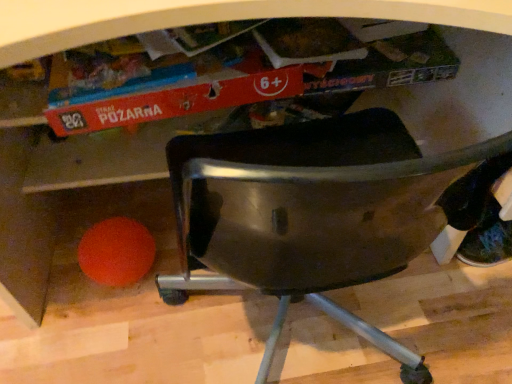
This screenshot has height=384, width=512. Describe the element at coordinates (320, 212) in the screenshot. I see `metallic black chair at center` at that location.

You are a GUI agent. You are given a task and a screenshot of the screen. Output one action in this format:
    pyautogui.click(x=<x>, y=<y>)
    Task: Click on the metallic black chair at center
    The width and height of the screenshot is (512, 384).
    Given the screenshot: What is the action you would take?
    pyautogui.click(x=320, y=212)

Image resolution: width=512 pixels, height=384 pixels. Identify the location of metallic black chair at center. (320, 212).